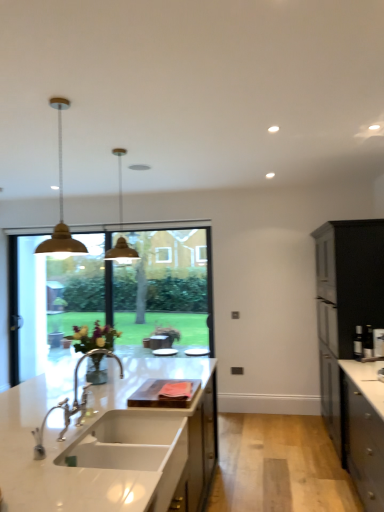
Question: From a real-world perspective, is metallic gold pendant light at center positioned above or below white glossy sink at center?

Choices:
 (A) below
 (B) above

Answer: (B)

Question: Considering the positions of metallic gold pendant light at center and white glossy sink at center in the image, is metallic gold pendant light at center taller or shorter than white glossy sink at center?

Choices:
 (A) short
 (B) tall

Answer: (B)

Question: Which is nearer to the metallic gold pendant light at center?

Choices:
 (A) chrome metallic faucet at sink left
 (B) white glossy sink at center
 (C) white marble countertop at center
 (D) gold matte pendant light at upper left
 (E) black matte cabinet at right

Answer: (A)

Question: Which object is positioned closest to the metallic gold pendant light at center?

Choices:
 (A) black matte cabinet at right
 (B) gold matte pendant light at upper left
 (C) chrome metallic faucet at sink left
 (D) white marble countertop at center
 (E) white glossy sink at center

Answer: (C)